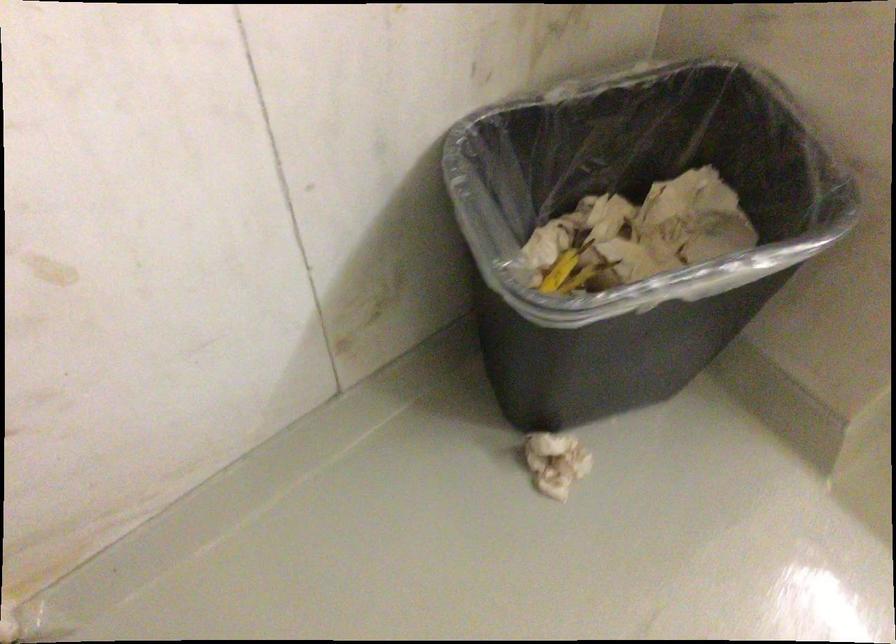
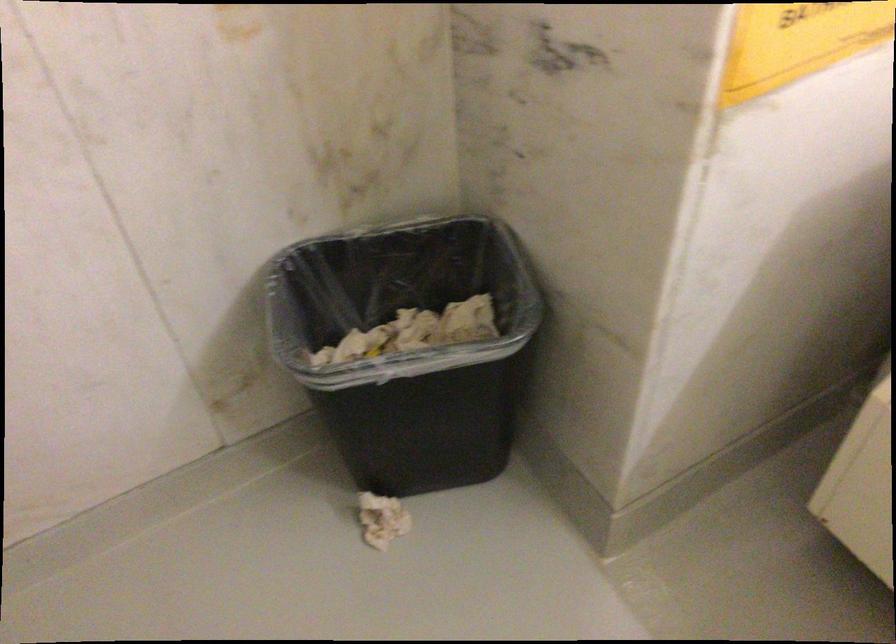
Locate, in the second image, the point that corresponds to pixel 557 462 in the first image.

(382, 520)